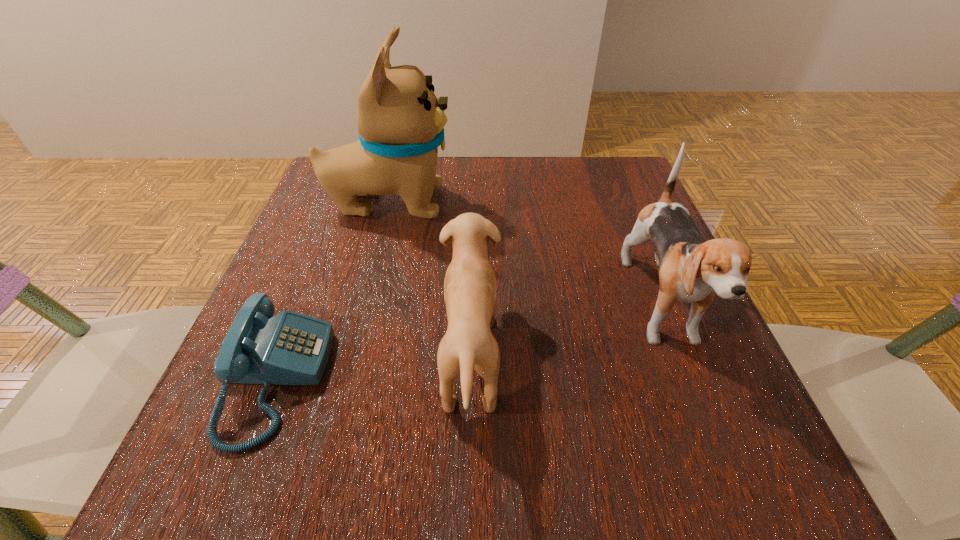
I want to click on the farthest object, so click(x=400, y=121).

Image resolution: width=960 pixels, height=540 pixels. What are the coordinates of `the tallest object` in the screenshot? It's located at (400, 121).

Where is `the rightmost puppy`? This screenshot has height=540, width=960. the rightmost puppy is located at coordinates (692, 270).

Locate an element on the screen. the rightmost object is located at coordinates (692, 270).

Identify the location of the shortest puppy. (470, 292).

At what (x,y) coordinates should I click in order to perform the action: click on the shortest object. Please return your answer as a coordinate pair (x, y). Looking at the image, I should click on (290, 348).

Image resolution: width=960 pixels, height=540 pixels. What are the coordinates of `free space located on the face of the tallest object` in the screenshot? It's located at (569, 203).

Identify the location of vacant region located 0.160m at the face of the rightmost object. Image resolution: width=960 pixels, height=540 pixels. (734, 496).

You are a GUI agent. You are given a task and a screenshot of the screen. Output one action in this format:
    pyautogui.click(x=<x>, y=<y>)
    Task: Click on the vacant region located on the left side of the shortest puppy
    The height and width of the screenshot is (540, 960).
    Given the screenshot: What is the action you would take?
    pyautogui.click(x=610, y=357)

You are a GUI agent. You are given a task and a screenshot of the screen. Output one action in this format:
    pyautogui.click(x=<x>, y=<y>)
    Task: Click on the vacant space located 0.190m on the dial of the shortest object
    The image size is (960, 540).
    Given the screenshot: What is the action you would take?
    pyautogui.click(x=451, y=380)